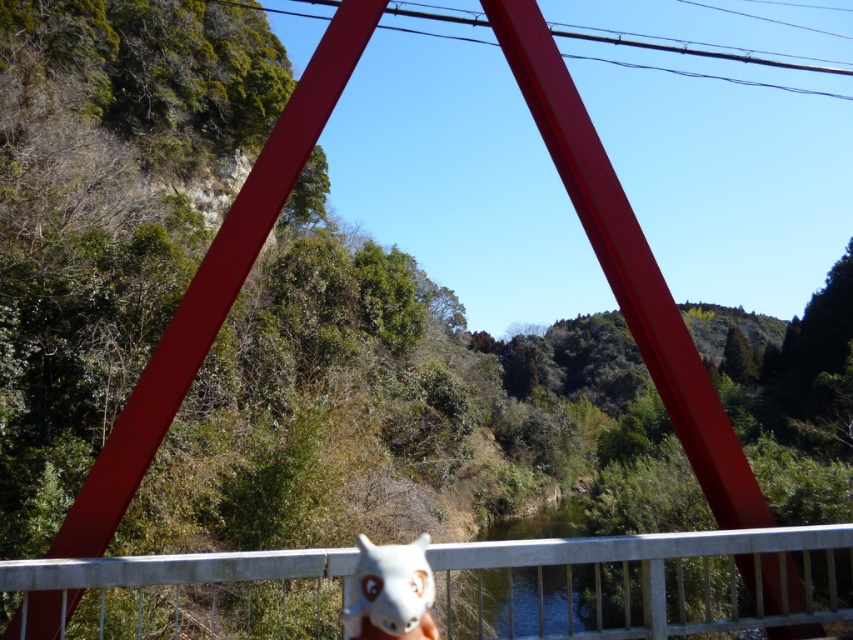
You are an artist planning to sketch this scene. You want to ensure the white metal rail at bottom and the white matte animal at center are proportionally accurate. Which object should you draw wider in your sketch?

The white metal rail at bottom should be drawn wider in the sketch since its width is larger than the white matte animal at center.

You are standing on the bridge and want to place a small object on the white metal rail at bottom. According to the coordinates provided, where exactly should you place it?

The white metal rail at bottom is located at coordinates point (641, 582).

In the scene shown: You are standing on the bridge and want to take a photo of the green smooth water at center without the white metal rail at bottom blocking the view. Is this possible?

The white metal rail at bottom is in front of the green smooth water at center, so it will block the view. To capture the green smooth water at center without obstruction, you would need to move to a position where the rail is not between you and the water.